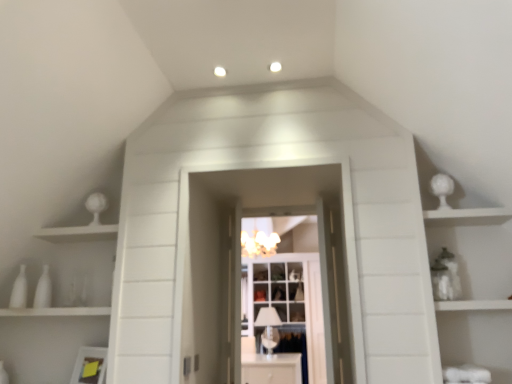
What is the approximate width of white glossy vases at left?

It is 14.11 inches.

What do you see at coordinates (476, 253) in the screenshot? I see `white glossy sphere at upper right` at bounding box center [476, 253].

You are a GUI agent. You are given a task and a screenshot of the screen. Output one action in this format:
    pyautogui.click(x=<x>, y=<y>)
    Task: Click on the white glossy door at center
    The width and height of the screenshot is (512, 384).
    Given the screenshot: What is the action you would take?
    pyautogui.click(x=344, y=241)

In the scene shown: In order to face clear glass cabinet at center, should I rotate leftwards or rightwards?

A 2.464 degree turn to the right will do.

This screenshot has width=512, height=384. What are the coordinates of `white glossy vases at left` in the screenshot? It's located at (57, 244).

Considering the positions of point (316, 375) and point (483, 274), is point (316, 375) closer or farther from the camera than point (483, 274)?

Point (316, 375) is farther from the camera than point (483, 274).

The image size is (512, 384). Find the location of `cupboard that is below the white glossy sphere at upper right (from the image's perspective)`. cupboard that is below the white glossy sphere at upper right (from the image's perspective) is located at coordinates (289, 301).

Are white glass cupboard at center and white glossy sphere at upper right located far from each other?

Yes, white glass cupboard at center is far from white glossy sphere at upper right.

Is white glass cupboard at center wider than white glossy sphere at upper right?

Incorrect, the width of white glass cupboard at center does not surpass that of white glossy sphere at upper right.

From the image's perspective, is white glossy vases at left above or below white glass cupboard at center?

Clearly, from the image's perspective, white glossy vases at left is above white glass cupboard at center.

From a real-world perspective, does white glossy vases at left stand above white glass cupboard at center?

Indeed, from a real-world perspective, white glossy vases at left stands above white glass cupboard at center.

Is white glossy vases at left wider or thinner than white glass cupboard at center?

white glossy vases at left is wider than white glass cupboard at center.

Locate an element on the screen. This screenshot has width=512, height=384. window below the white frosted glass light fixture at center (from a real-world perspective) is located at coordinates (279, 290).

Between white frosted glass light fixture at center and clear glass cabinet at center, which one appears on the right side from the viewer's perspective?

clear glass cabinet at center.

Is white frosted glass light fixture at center touching clear glass cabinet at center?

white frosted glass light fixture at center and clear glass cabinet at center are clearly separated.

Which object is closer to the camera, white frosted glass light fixture at center or clear glass cabinet at center?

white frosted glass light fixture at center.

From the picture: Can we say white glossy cabinet at center lies outside clear glass cabinet at center?

Yes, white glossy cabinet at center is not within clear glass cabinet at center.

Which is less distant, (x=283, y=382) or (x=254, y=264)?

The point (x=283, y=382) is closer.

From a real-world perspective, is white glossy cabinet at center below clear glass cabinet at center?

Yes, from a real-world perspective, white glossy cabinet at center is beneath clear glass cabinet at center.

Can you confirm if white glossy cabinet at center is taller than clear glass cabinet at center?

No.

Could you tell me if white glossy door at center is facing white glass cupboard at center?

Yes, white glossy door at center is oriented towards white glass cupboard at center.

From the picture: Which object is positioned more to the left, white glossy door at center or white glass cupboard at center?

From the viewer's perspective, white glossy door at center appears more on the left side.

What's the angular difference between white glossy door at center and white glass cupboard at center's facing directions?

The facing directions of white glossy door at center and white glass cupboard at center are 180 degrees apart.

Where is `cupboard located on the right of white glossy door at center`? This screenshot has height=384, width=512. cupboard located on the right of white glossy door at center is located at coordinates (289, 301).

From the image's perspective, between clear glass cabinet at center and white glossy door at center, which one is located above?

white glossy door at center, from the image's perspective.

How different are the orientations of clear glass cabinet at center and white glossy door at center in degrees?

There is a 2.06-degree angle between the facing directions of clear glass cabinet at center and white glossy door at center.

Who is smaller, clear glass cabinet at center or white glossy door at center?

Smaller between the two is white glossy door at center.

From a real-world perspective, is clear glass cabinet at center physically located above or below white glossy door at center?

clear glass cabinet at center is above white glossy door at center.

Is white glossy cabinet at center positioned far away from white glossy door at center?

Absolutely, white glossy cabinet at center is distant from white glossy door at center.

From the image's perspective, would you say white glossy cabinet at center is shown under white glossy door at center?

Yes, from the image's perspective, white glossy cabinet at center is below white glossy door at center.

Between point (286, 382) and point (349, 238), which one is positioned in front?

Point (349, 238)

Can you tell me how much white glossy cabinet at center and white glossy door at center differ in facing direction?

white glossy cabinet at center and white glossy door at center are facing 2.69 degrees away from each other.

In the image, there is a white glass cupboard at center. Identify the location of cabinet above it (from the image's perspective). This screenshot has width=512, height=384. (476, 253).

You are a GUI agent. You are given a task and a screenshot of the screen. Output one action in this format:
    pyautogui.click(x=<x>, y=<y>)
    Task: Click on the shelf located in front of the white glass cupboard at center
    The height and width of the screenshot is (384, 512).
    Given the screenshot: What is the action you would take?
    pyautogui.click(x=57, y=244)

Based on their spatial positions, is white glossy door at center or white frosted glass light fixture at center further from white glossy vases at left?

white frosted glass light fixture at center is positioned further to the anchor white glossy vases at left.

When comparing their distances from white glossy sphere at upper right, does clear glass cabinet at center or white glossy door at center seem closer?

white glossy door at center.

When comparing their distances from white frosted glass light fixture at center, does white glossy door at center or white glossy vases at left seem closer?

Based on the image, white glossy vases at left appears to be nearer to white frosted glass light fixture at center.

Estimate the real-world distances between objects in this image. Which object is closer to white glossy door at center, clear glass cabinet at center or white glossy cabinet at center?

white glossy cabinet at center.

From the image, which object appears to be nearer to white glossy door at center, white glossy cabinet at center or white glossy vases at left?

white glossy vases at left is closer to white glossy door at center.

Which object lies nearer to the anchor point white glossy cabinet at center, white glossy sphere at upper right or white frosted glass light fixture at center?

white frosted glass light fixture at center is closer to white glossy cabinet at center.

Which object lies nearer to the anchor point white glossy door at center, white glossy sphere at upper right or white frosted glass light fixture at center?

white glossy sphere at upper right lies closer to white glossy door at center than the other object.

When comparing their distances from white glass cupboard at center, does white frosted glass light fixture at center or white glossy cabinet at center seem further?

white frosted glass light fixture at center.

Locate an element on the screen. Image resolution: width=512 pixels, height=384 pixels. door located between white glossy vases at left and white glass cupboard at center in the left-right direction is located at coordinates [x=344, y=241].

Where is `shelf between white glossy door at center and white frosted glass light fixture at center in the front-back direction`? This screenshot has height=384, width=512. shelf between white glossy door at center and white frosted glass light fixture at center in the front-back direction is located at coordinates (57, 244).

Where is `light fixture between white glass cupboard at center and clear glass cabinet at center from front to back`? The height and width of the screenshot is (384, 512). light fixture between white glass cupboard at center and clear glass cabinet at center from front to back is located at coordinates (258, 237).

Where is `cupboard located between white glossy sphere at upper right and white frosted glass light fixture at center in the depth direction`? The height and width of the screenshot is (384, 512). cupboard located between white glossy sphere at upper right and white frosted glass light fixture at center in the depth direction is located at coordinates (289, 301).